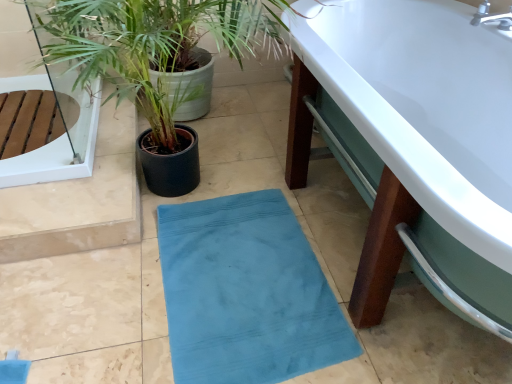
Question: Is point (22, 59) positioned closer to the camera than point (84, 158)?

Choices:
 (A) closer
 (B) farther

Answer: (B)

Question: From a real-world perspective, relative to transparent glass door at upper left, is green leafy plant at left vertically above or below?

Choices:
 (A) below
 (B) above

Answer: (B)

Question: Which of these objects is positioned closest to the green leafy plant at left?

Choices:
 (A) transparent glass door at upper left
 (B) white glossy bathtub at lower right
 (C) teal fabric bath mat at center

Answer: (A)

Question: Estimate the real-world distances between objects in this image. Which object is farther from the teal fabric bath mat at center?

Choices:
 (A) white glossy bathtub at lower right
 (B) green leafy plant at left
 (C) transparent glass door at upper left

Answer: (B)